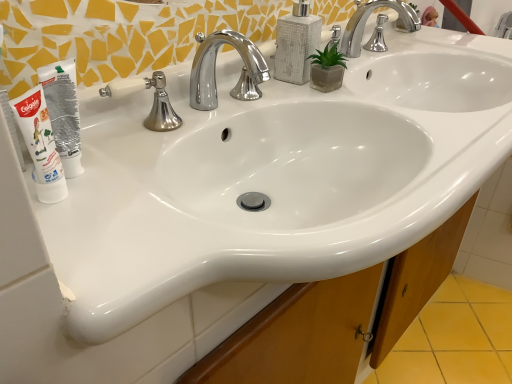
The image size is (512, 384). I want to click on free space to the back side of white tube at left, so click(x=156, y=137).